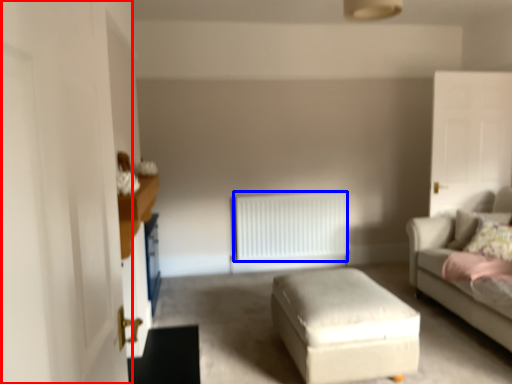
Question: Which object is further to the camera taking this photo, glass door (highlighted by a red box) or radiator (highlighted by a blue box)?

Choices:
 (A) glass door
 (B) radiator

Answer: (B)